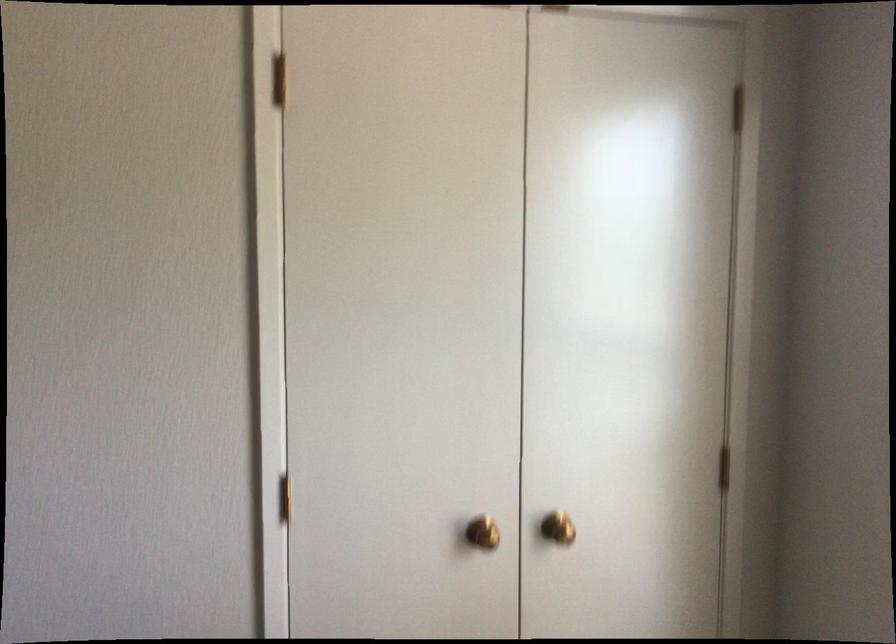
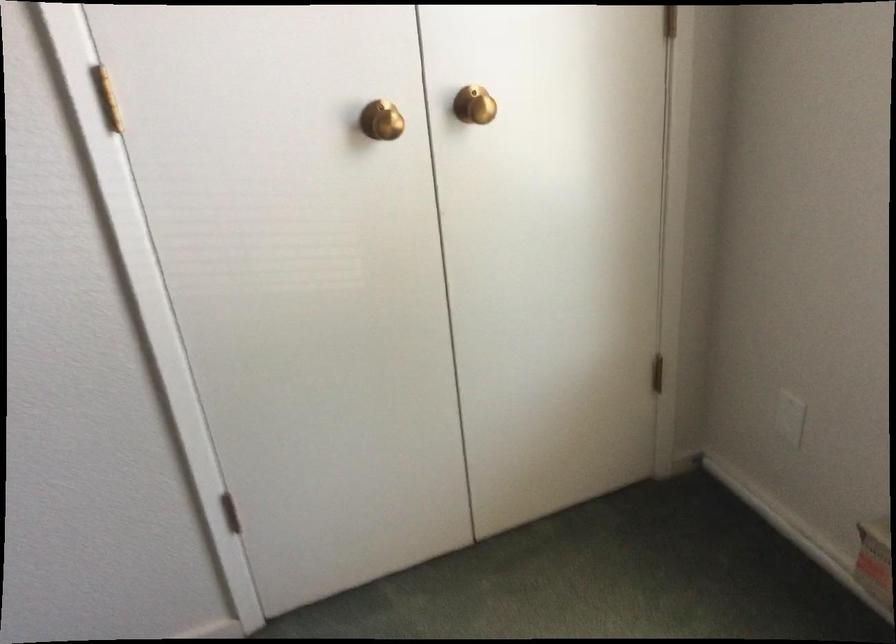
Question: The first image is from the beginning of the video and the second image is from the end. How did the camera likely rotate when shooting the video?

Choices:
 (A) Left
 (B) Right
 (C) Up
 (D) Down

Answer: (D)